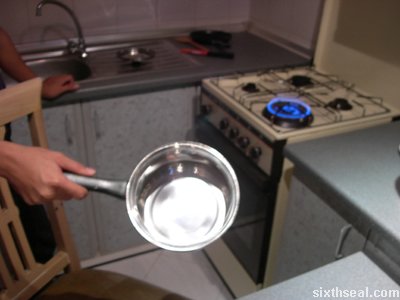
Where is `handle`? The width and height of the screenshot is (400, 300). handle is located at coordinates (96, 184), (68, 132), (95, 123), (342, 235), (192, 51).